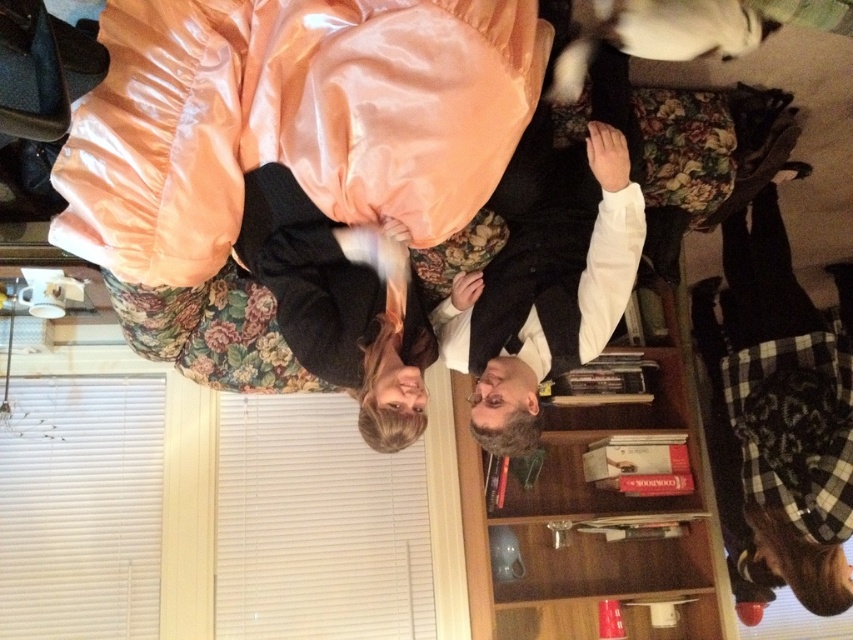
Question: Can you confirm if silky peach sleeping bag at upper left is positioned to the left of wooden bookshelf at center?

Choices:
 (A) yes
 (B) no

Answer: (A)

Question: Among these points, which one is nearest to the camera?

Choices:
 (A) (648, 580)
 (B) (289, 134)

Answer: (B)

Question: Among these objects, which one is farthest from the camera?

Choices:
 (A) silky peach sleeping bag at upper left
 (B) wooden bookshelf at center

Answer: (B)

Question: Is silky peach sleeping bag at upper left smaller than wooden bookshelf at center?

Choices:
 (A) yes
 (B) no

Answer: (A)

Question: Is silky peach sleeping bag at upper left thinner than wooden bookshelf at center?

Choices:
 (A) yes
 (B) no

Answer: (A)